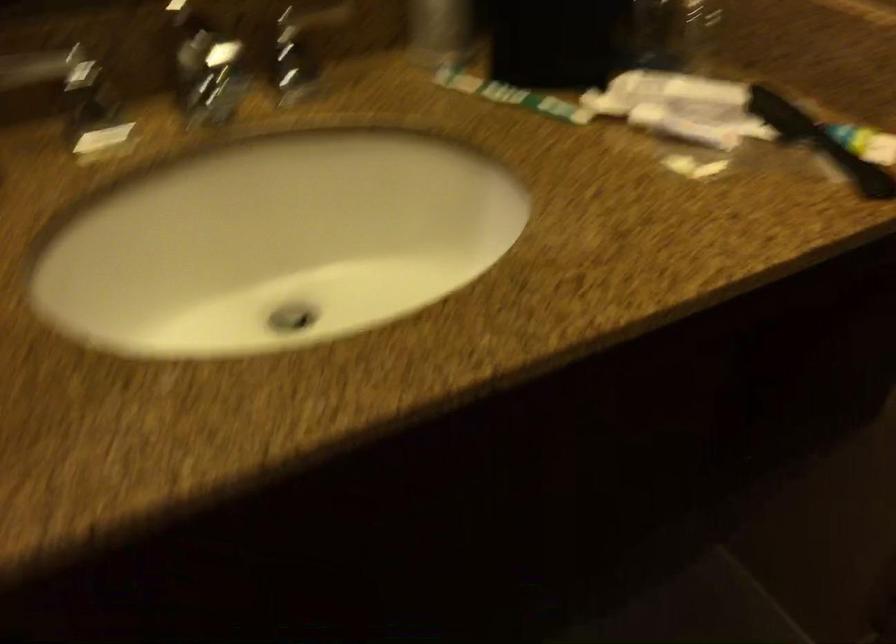
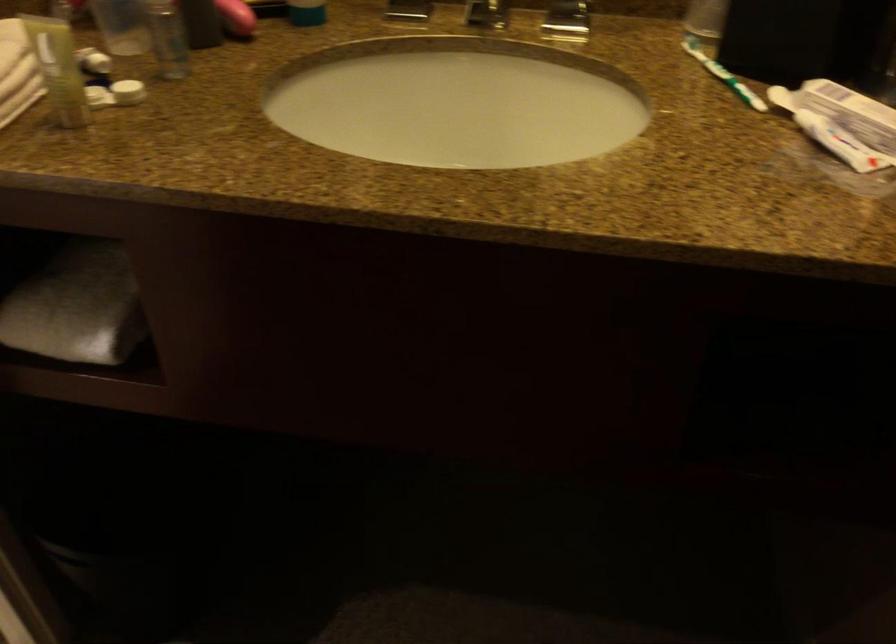
Where in the second image is the point corresponding to pixel 695 125 from the first image?

(840, 143)